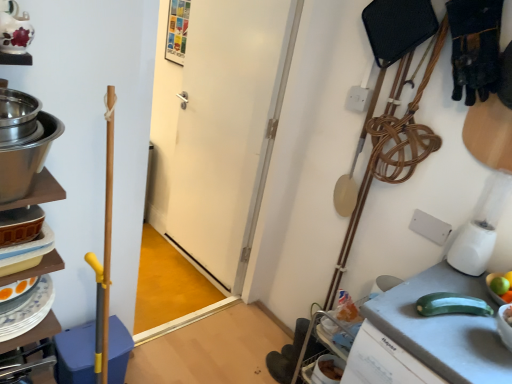
Question: From the image's perspective, is white matte door at center under green matte zucchini at lower right?

Choices:
 (A) yes
 (B) no

Answer: (B)

Question: From a real-world perspective, is white matte door at center under green matte zucchini at lower right?

Choices:
 (A) no
 (B) yes

Answer: (A)

Question: Is the depth of white matte door at center less than that of green matte zucchini at lower right?

Choices:
 (A) no
 (B) yes

Answer: (A)

Question: Could you tell me if white matte door at center is turned towards green matte zucchini at lower right?

Choices:
 (A) yes
 (B) no

Answer: (B)

Question: Considering the relative positions of white matte door at center and green matte zucchini at lower right in the image provided, is white matte door at center behind green matte zucchini at lower right?

Choices:
 (A) yes
 (B) no

Answer: (A)

Question: From a real-world perspective, is yellow smooth zucchini at right physically located above or below green matte apple at right?

Choices:
 (A) above
 (B) below

Answer: (A)

Question: Considering the positions of yellow smooth zucchini at right and green matte apple at right in the image, is yellow smooth zucchini at right bigger or smaller than green matte apple at right?

Choices:
 (A) small
 (B) big

Answer: (B)

Question: Considering the positions of yellow smooth zucchini at right and green matte apple at right in the image, is yellow smooth zucchini at right taller or shorter than green matte apple at right?

Choices:
 (A) short
 (B) tall

Answer: (B)

Question: Is point (509, 321) positioned closer to the camera than point (499, 301)?

Choices:
 (A) farther
 (B) closer

Answer: (B)

Question: Based on their sizes in the image, would you say white plastic blender at right is bigger or smaller than yellow smooth zucchini at right?

Choices:
 (A) big
 (B) small

Answer: (A)

Question: Is point (488, 193) positioned closer to the camera than point (508, 317)?

Choices:
 (A) closer
 (B) farther

Answer: (B)

Question: From the image's perspective, is white plastic blender at right above or below yellow smooth zucchini at right?

Choices:
 (A) above
 (B) below

Answer: (A)

Question: Considering their positions, is white plastic blender at right located in front of or behind yellow smooth zucchini at right?

Choices:
 (A) behind
 (B) front

Answer: (A)

Question: Is point (457, 243) positioned closer to the camera than point (54, 132)?

Choices:
 (A) farther
 (B) closer

Answer: (A)

Question: Considering the positions of white plastic blender at right and stainless steel bowls at left in the image, is white plastic blender at right bigger or smaller than stainless steel bowls at left?

Choices:
 (A) small
 (B) big

Answer: (A)